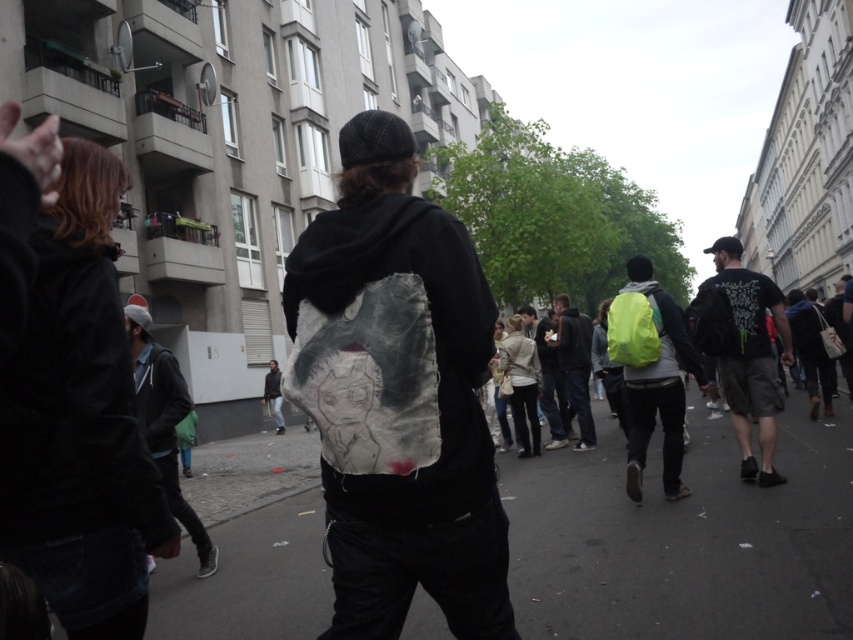
Can you confirm if rough canvas bag at center is thinner than dark green t-shirt at right?

Yes, rough canvas bag at center is thinner than dark green t-shirt at right.

Is point (428, 221) less distant than point (746, 339)?

Yes.

Identify the location of rough canvas bag at center. This screenshot has width=853, height=640. (397, 396).

Who is more distant from viewer, [368,547] or [173,422]?

The point [173,422] is behind.

Does point (450, 349) come closer to viewer compared to point (190, 512)?

Yes, point (450, 349) is in front of point (190, 512).

Is point (372, 509) farther from camera compared to point (152, 340)?

No.

Find the location of a particular element. The height and width of the screenshot is (640, 853). rough canvas bag at center is located at coordinates (397, 396).

Who is positioned more to the left, dark gray hoodie at left or dark gray fabric backpack at center?

dark gray hoodie at left

Between dark gray hoodie at left and dark gray fabric backpack at center, which one is positioned higher?

Positioned higher is dark gray fabric backpack at center.

Image resolution: width=853 pixels, height=640 pixels. I want to click on dark gray hoodie at left, so click(x=164, y=422).